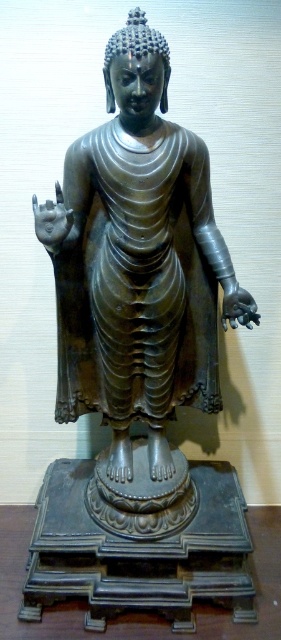
Question: Observing the image, what is the correct spatial positioning of polished bronze statue at center in reference to polished dark wood table at center?

Choices:
 (A) right
 (B) left

Answer: (B)

Question: Which object appears closest to the camera in this image?

Choices:
 (A) polished dark wood table at center
 (B) polished bronze statue at center

Answer: (B)

Question: Does polished bronze statue at center appear on the right side of polished dark wood table at center?

Choices:
 (A) yes
 (B) no

Answer: (B)

Question: Among these objects, which one is nearest to the camera?

Choices:
 (A) polished bronze statue at center
 (B) polished dark wood table at center

Answer: (A)

Question: Can you confirm if polished bronze statue at center is bigger than polished dark wood table at center?

Choices:
 (A) yes
 (B) no

Answer: (A)